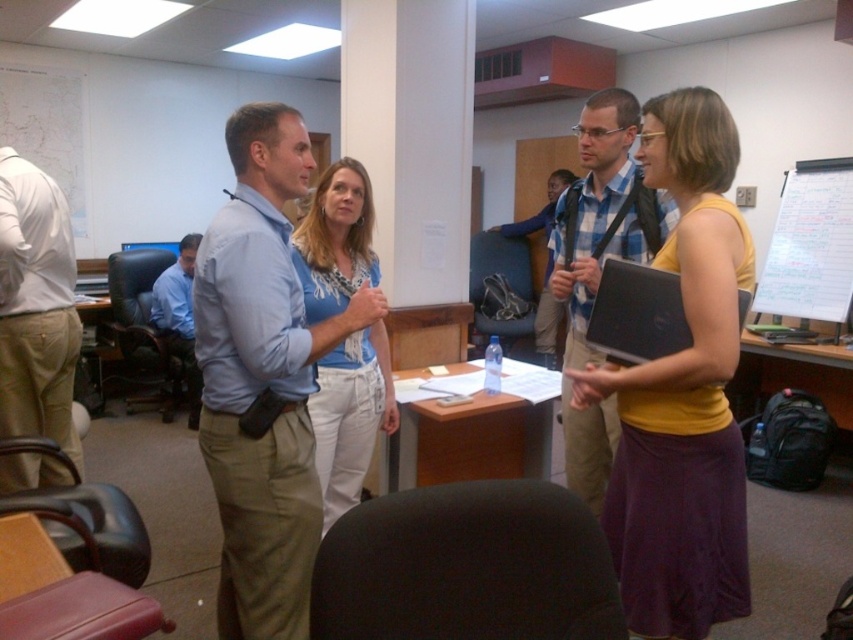
Can you confirm if matte yellow tank top at center is positioned below plaid cotton shirt at center?

Yes, matte yellow tank top at center is below plaid cotton shirt at center.

Is point (665, 557) positioned before point (579, 360)?

Yes, point (665, 557) is closer to viewer.

Is point (625, 493) less distant than point (619, 154)?

Yes, point (625, 493) is in front of point (619, 154).

Locate an element on the screen. This screenshot has height=640, width=853. matte yellow tank top at center is located at coordinates (683, 394).

Where is `plaid cotton shirt at center`? The width and height of the screenshot is (853, 640). plaid cotton shirt at center is located at coordinates (599, 266).

Is plaid cotton shirt at center to the right of blue plaid shirt at center from the viewer's perspective?

In fact, plaid cotton shirt at center is to the left of blue plaid shirt at center.

At what (x,y) coordinates should I click in order to perform the action: click on plaid cotton shirt at center. Please return your answer as a coordinate pair (x, y). The image size is (853, 640). Looking at the image, I should click on (599, 266).

Does matte yellow tank top at center have a lesser width compared to blue cotton shirt at center?

No.

Is point (735, 365) farther from camera compared to point (312, 300)?

No, (735, 365) is in front of (312, 300).

This screenshot has width=853, height=640. I want to click on matte yellow tank top at center, so click(683, 394).